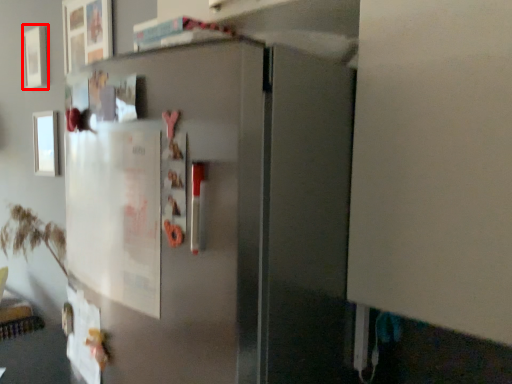
Question: Where is picture frame (annotated by the red box) located in relation to picture frame in the image?

Choices:
 (A) right
 (B) left

Answer: (B)